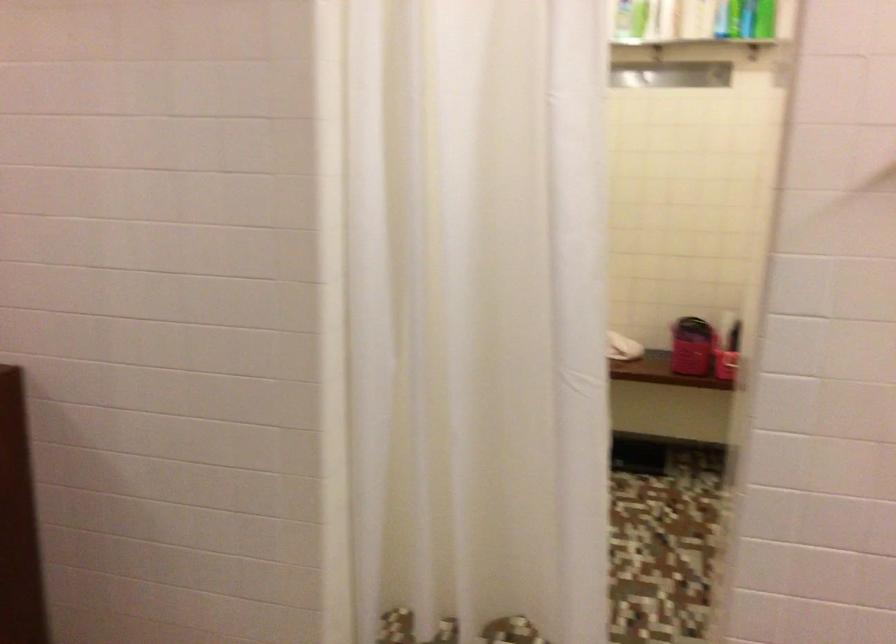
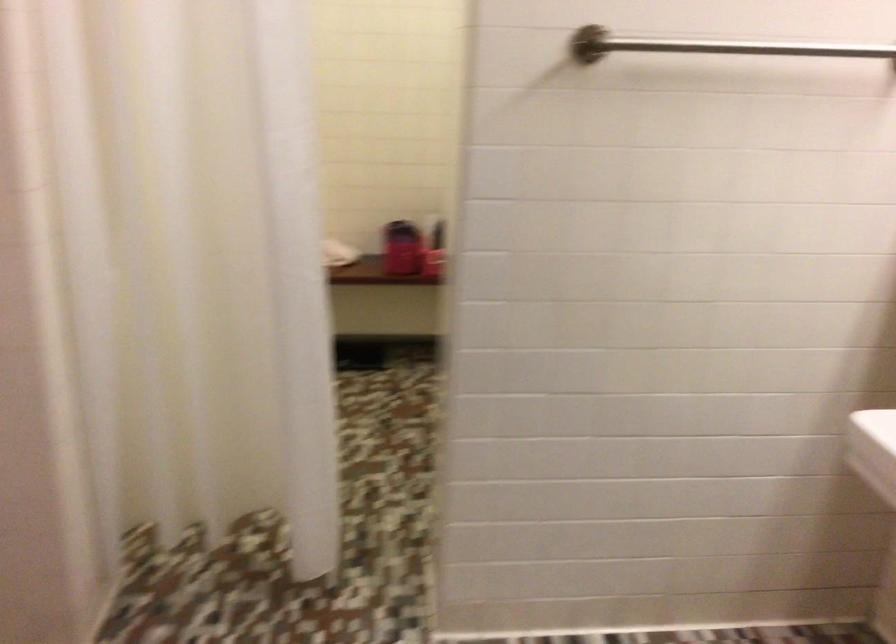
Based on the photo, the images are taken continuously from a first-person perspective. In which direction are you moving?

The movement direction of the cameraman is left, backward.